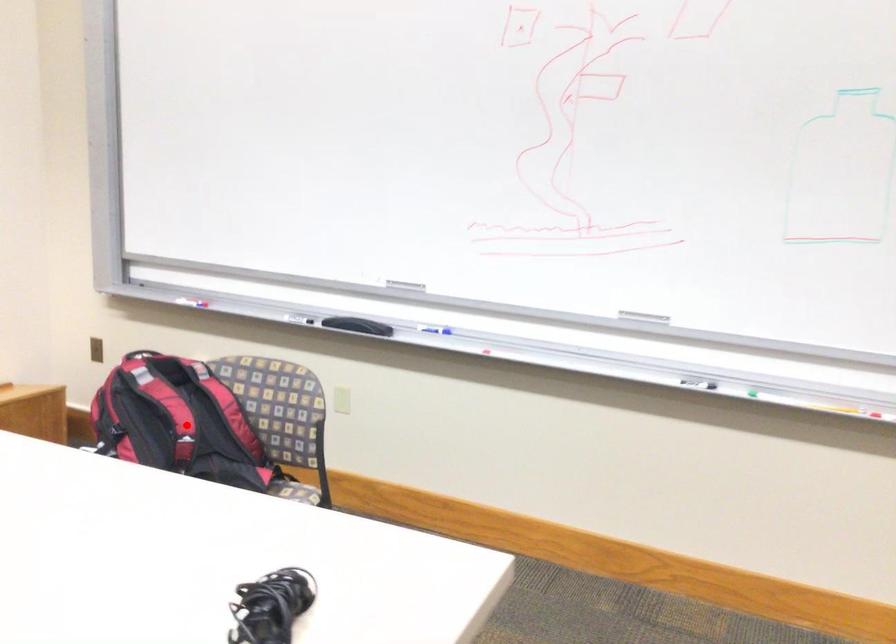
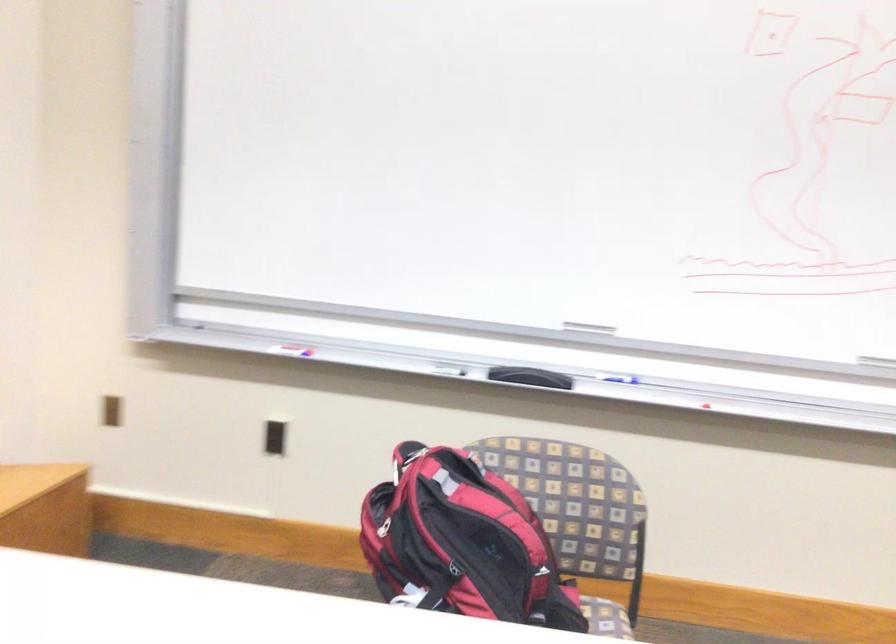
In the second image, find the point that corresponds to the highlighted location in the first image.

(478, 542)